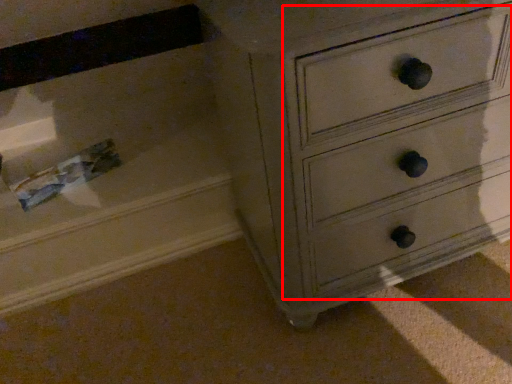
Question: Where is drawer (annotated by the red box) located in relation to drawer in the image?

Choices:
 (A) left
 (B) right

Answer: (B)